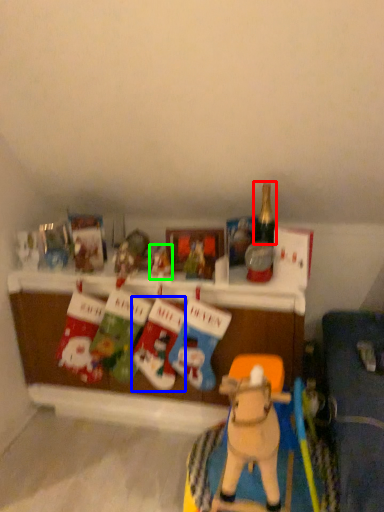
Question: Which is farther away from bottle (highlighted by a red box)? toy (highlighted by a blue box) or toy (highlighted by a green box)?

Choices:
 (A) toy
 (B) toy

Answer: (A)